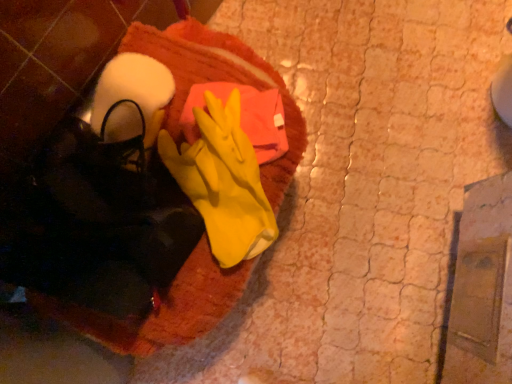
Where is `yellow rubber glove at center`? yellow rubber glove at center is located at coordinates (223, 182).

Describe the element at coordinates (223, 182) in the screenshot. I see `yellow rubber glove at center` at that location.

Looking at this image, in order to face orange towel at center, should I rotate leftwards or rightwards?

To face it directly, rotate left by 10.088 degrees.

This screenshot has width=512, height=384. What do you see at coordinates (219, 80) in the screenshot?
I see `orange towel at center` at bounding box center [219, 80].

Looking at this image, measure the distance between point [203,286] and camera.

Point [203,286] and camera are 28.94 inches apart.

What are the coordinates of `orange towel at center` in the screenshot? It's located at (219, 80).

Find the location of `yellow rubber glove at center`. yellow rubber glove at center is located at coordinates (223, 182).

Based on their positions, is orange towel at center located to the left or right of yellow rubber glove at center?

Clearly, orange towel at center is on the left of yellow rubber glove at center in the image.

Who is more distant, orange towel at center or yellow rubber glove at center?

orange towel at center.

Between point (212, 301) and point (240, 165), which one is positioned in front?

The point (240, 165) is closer.

From the image's perspective, between orange towel at center and yellow rubber glove at center, who is located below?

orange towel at center.

From a real-world perspective, which object rests below the other?

orange towel at center is physically lower.

Which object is thinner, orange towel at center or yellow rubber glove at center?

yellow rubber glove at center.

Considering the sizes of orange towel at center and yellow rubber glove at center in the image, is orange towel at center taller or shorter than yellow rubber glove at center?

Clearly, orange towel at center is taller compared to yellow rubber glove at center.

Who is smaller, orange towel at center or yellow rubber glove at center?

Smaller between the two is yellow rubber glove at center.

Is orange towel at center completely or partially outside of yellow rubber glove at center?

Yes, orange towel at center is located beyond the bounds of yellow rubber glove at center.

Based on the photo, is orange towel at center far from yellow rubber glove at center?

Actually, orange towel at center and yellow rubber glove at center are a little close together.

Does orange towel at center turn towards yellow rubber glove at center?

No, orange towel at center is not oriented towards yellow rubber glove at center.

Find the location of a particular element. This screenshot has width=512, height=384. blanket below the yellow rubber glove at center (from the image's perspective) is located at coordinates (219, 80).

Does yellow rubber glove at center appear on the right side of orange towel at center?

Correct, you'll find yellow rubber glove at center to the right of orange towel at center.

Which is in front, yellow rubber glove at center or orange towel at center?

yellow rubber glove at center is more forward.

Does point (207, 170) lie behind point (236, 66)?

No.

From the image's perspective, which one is positioned higher, yellow rubber glove at center or orange towel at center?

yellow rubber glove at center.

From a real-world perspective, which object stands above the other?

yellow rubber glove at center, from a real-world perspective.

In terms of width, does yellow rubber glove at center look wider or thinner when compared to orange towel at center?

yellow rubber glove at center is thinner than orange towel at center.

Between yellow rubber glove at center and orange towel at center, which one has more height?

orange towel at center.

Does yellow rubber glove at center have a larger size compared to orange towel at center?

No, yellow rubber glove at center is not bigger than orange towel at center.

Would you say yellow rubber glove at center contains orange towel at center?

No, orange towel at center is not a part of yellow rubber glove at center.

Would you say yellow rubber glove at center is a long distance from orange towel at center?

No, yellow rubber glove at center is in close proximity to orange towel at center.

Could you tell me if yellow rubber glove at center is turned towards orange towel at center?

Yes, yellow rubber glove at center is aimed at orange towel at center.

Where is `glove lying on the right of orange towel at center`? The height and width of the screenshot is (384, 512). glove lying on the right of orange towel at center is located at coordinates tap(223, 182).

Find the location of a particular element. blanket that appears below the yellow rubber glove at center (from the image's perspective) is located at coordinates (219, 80).

Where is `glove above the orange towel at center (from a real-world perspective)`? glove above the orange towel at center (from a real-world perspective) is located at coordinates (223, 182).